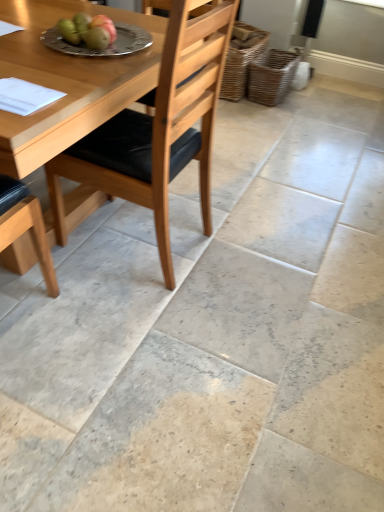
Where is `space that is in front of silver metallic plate at upper center`? The image size is (384, 512). space that is in front of silver metallic plate at upper center is located at coordinates (68, 65).